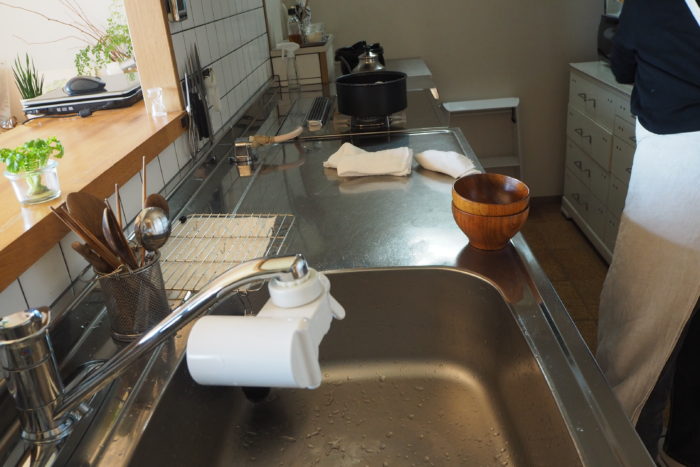
You are a GUI agent. You are given a task and a screenshot of the screen. Output one action in this format:
    pyautogui.click(x=<x>, y=<y>)
    Task: Click on the stove top
    
    Given the screenshot: What is the action you would take?
    pyautogui.click(x=407, y=119)